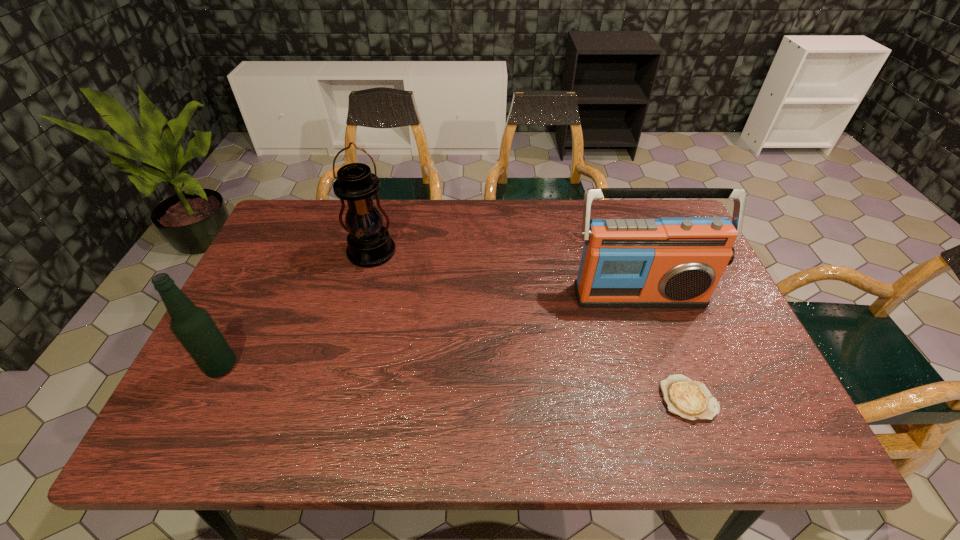
The height and width of the screenshot is (540, 960). What are the coordinates of `vacant region at the near left corner of the desktop` in the screenshot? It's located at (200, 434).

The width and height of the screenshot is (960, 540). What are the coordinates of `free location at the near right corner of the desktop` in the screenshot? It's located at (744, 442).

Identify the location of vacant area that lies between the quiche and the radio receiver. The image size is (960, 540). (663, 346).

The height and width of the screenshot is (540, 960). I want to click on empty space that is in between the radio receiver and the alcohol, so click(430, 330).

Find the location of a particular element. Image resolution: width=960 pixels, height=540 pixels. free space between the farthest object and the second farthest object is located at coordinates (505, 274).

At what (x,y) coordinates should I click in order to perform the action: click on free space between the leftmost object and the quiche. Please return your answer as a coordinate pair (x, y). This screenshot has height=540, width=960. Looking at the image, I should click on (455, 382).

Where is `vacant area that lies between the quiche and the alcohol`? The image size is (960, 540). vacant area that lies between the quiche and the alcohol is located at coordinates (455, 382).

Where is `vacant area between the third object from right to left and the alcohol`? The width and height of the screenshot is (960, 540). vacant area between the third object from right to left and the alcohol is located at coordinates (297, 310).

Identify the location of empty space that is in between the second farthest object and the second object from left to right. (505, 274).

Identify the location of vacant space that is in between the alcohol and the shortest object. (455, 382).